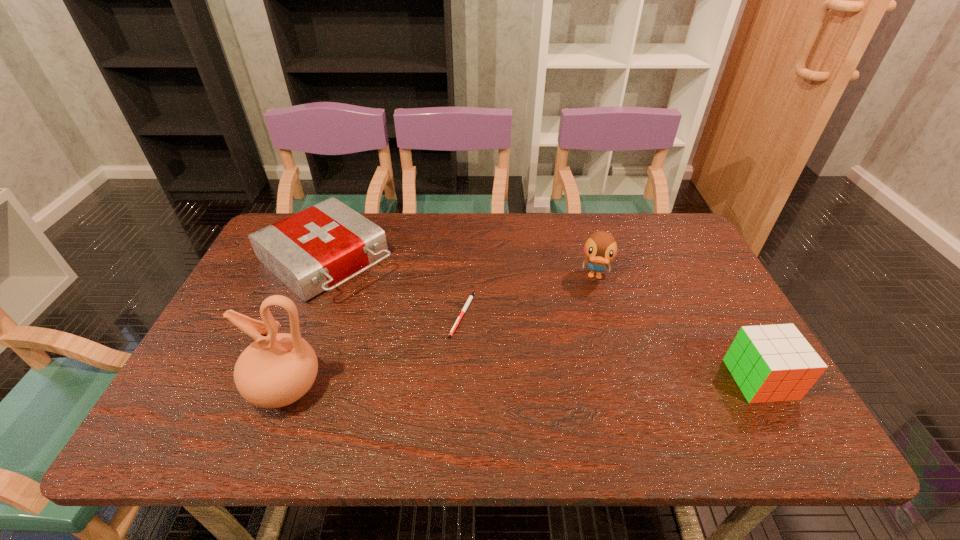
The height and width of the screenshot is (540, 960). I want to click on blank space located on the front side of the fourth tallest object, so click(x=424, y=335).

Identify the location of free spot located 0.110m on the front side of the fourth tallest object. (395, 312).

Identify the location of free space located on the front side of the fourth tallest object. This screenshot has height=540, width=960. pos(383,302).

What are the coordinates of `vacant space located 0.050m on the clicker of the shortest object` in the screenshot? It's located at (467, 354).

Locate an element on the screen. The width and height of the screenshot is (960, 540). free space located 0.100m on the clicker of the shortest object is located at coordinates (470, 371).

I want to click on vacant region located on the clicker of the shortest object, so click(x=468, y=357).

Identify the location of vacant space situated 0.160m on the front-facing side of the fourth object from left to right. (591, 331).

The width and height of the screenshot is (960, 540). I want to click on free spot located 0.140m on the front-facing side of the fourth object from left to right, so click(591, 325).

Find the location of `vacant area situated on the front-facing side of the fourth object from left to right`. vacant area situated on the front-facing side of the fourth object from left to right is located at coordinates click(587, 372).

Image resolution: width=960 pixels, height=540 pixels. In order to click on object that is at the far edge in this screenshot , I will do `click(323, 245)`.